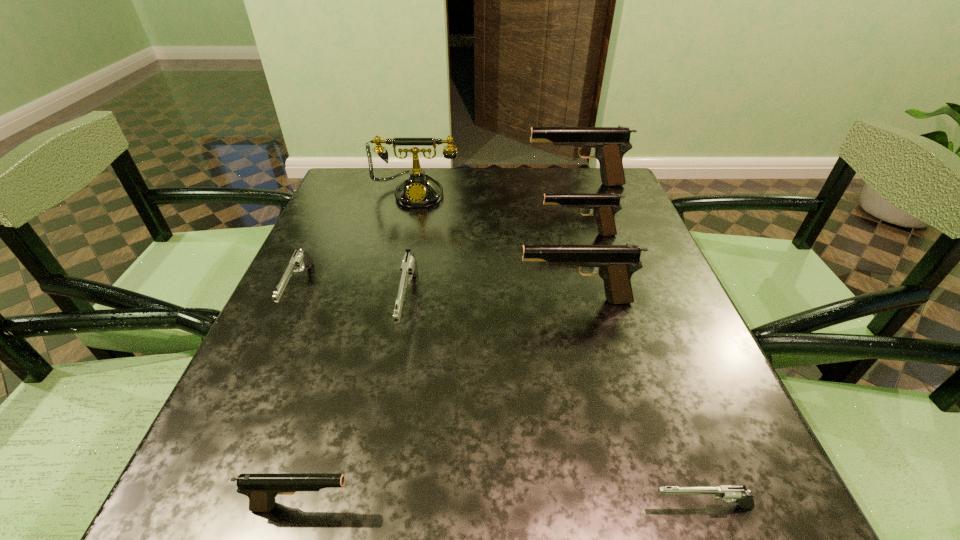
Where is `free space located 0.050m at the muzzle of the second nearest black pistol`? This screenshot has width=960, height=540. free space located 0.050m at the muzzle of the second nearest black pistol is located at coordinates (493, 301).

The image size is (960, 540). What are the coordinates of `vacant space located 0.110m at the muzzle of the second nearest black pistol` in the screenshot? It's located at (464, 301).

I want to click on vacant space located at the muzzle of the third farthest object, so click(x=456, y=234).

Find the location of a particular element. vacant space located 0.310m at the muzzle of the third farthest object is located at coordinates click(x=409, y=234).

This screenshot has height=540, width=960. In order to click on free spot located at the muzzle of the third farthest object in this screenshot , I will do `click(435, 234)`.

You are a GUI agent. You are given a task and a screenshot of the screen. Output one action in this format:
    pyautogui.click(x=<x>, y=<y>)
    Task: Click on the free region located on the front-facing side of the third pistol from left to right
    The height and width of the screenshot is (540, 960).
    Given the screenshot: What is the action you would take?
    pyautogui.click(x=387, y=434)

Image resolution: width=960 pixels, height=540 pixels. In order to click on free region located 0.210m at the muzzle of the second pistol from left to right in this screenshot , I will do pos(514,506).

The width and height of the screenshot is (960, 540). Find the location of `vacant space situated on the front-facing side of the leftmost object`. vacant space situated on the front-facing side of the leftmost object is located at coordinates (258, 381).

The width and height of the screenshot is (960, 540). Find the location of `vacant space located on the front-facing side of the shortest pistol`. vacant space located on the front-facing side of the shortest pistol is located at coordinates (468, 507).

In order to click on free space located on the front-facing side of the shortest pistol in this screenshot , I will do `click(559, 507)`.